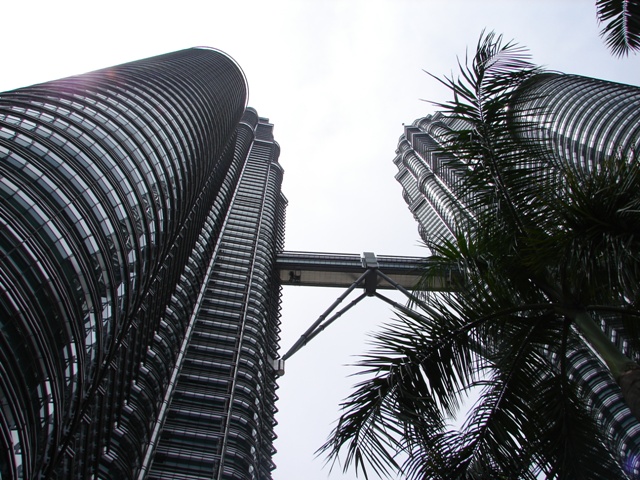
The height and width of the screenshot is (480, 640). Find the location of `beams`. beams is located at coordinates (326, 314), (329, 319), (404, 292), (394, 304).